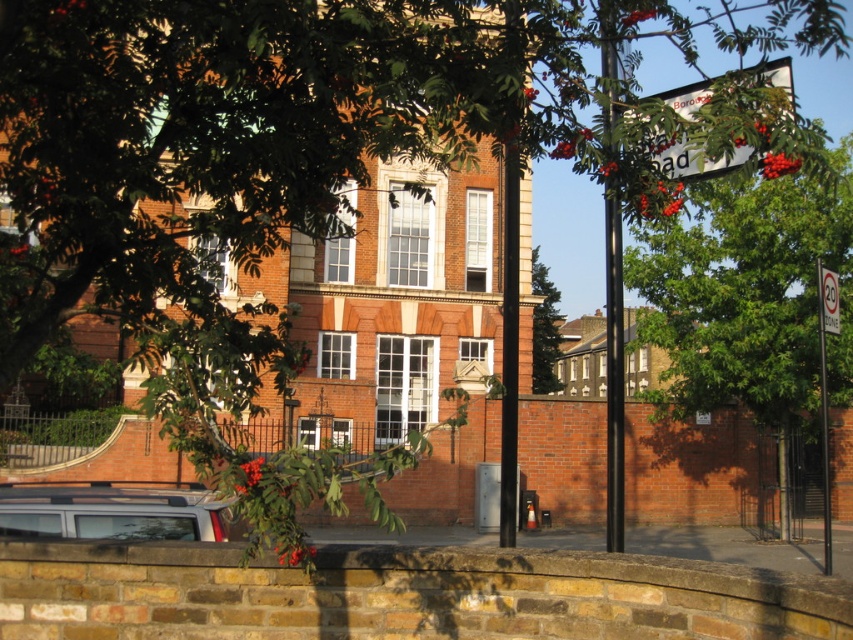
You are a painter setting up your easel to paint the scene. You want to focus on the green leafy tree at upper right and the black metal pole at right. Which object takes up more space in the painting?

The black metal pole at right takes up more space in the painting because the green leafy tree at upper right occupies less space than the black metal pole at right.